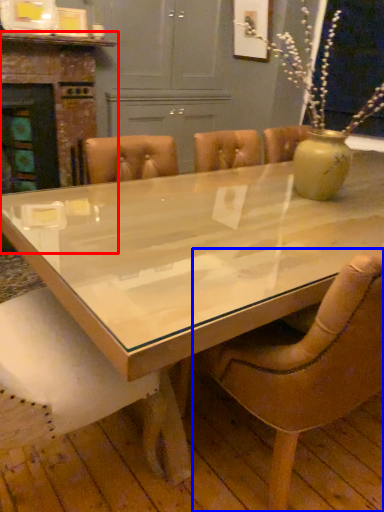
Question: Which object is further to the camera taking this photo, fireplace (highlighted by a red box) or chair (highlighted by a blue box)?

Choices:
 (A) fireplace
 (B) chair

Answer: (A)